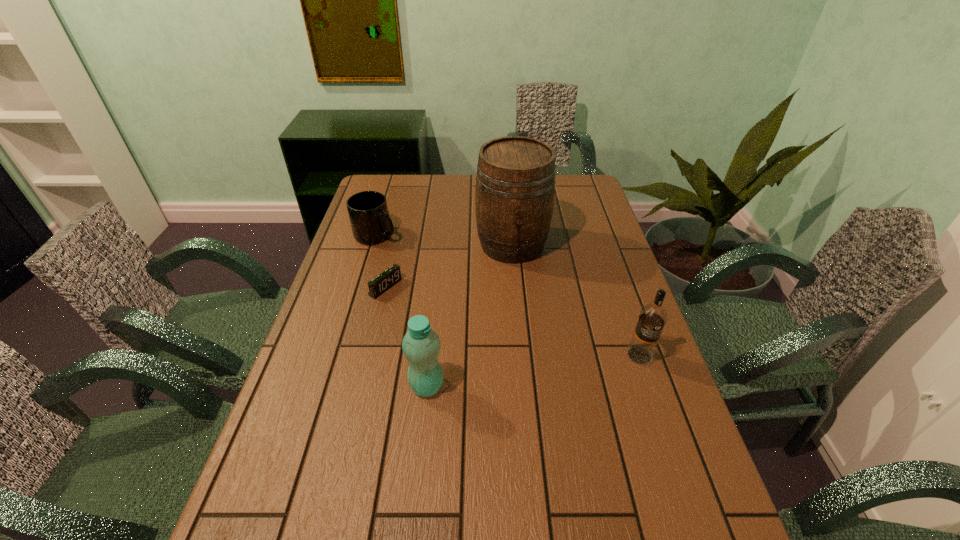
In order to click on vacant region located 0.150m on the label of the vodka in this screenshot , I will do `click(661, 419)`.

You are a GUI agent. You are given a task and a screenshot of the screen. Output one action in this format:
    pyautogui.click(x=<x>, y=<y>)
    Task: Click on the free space located on the side of the second object from right to left near the bung hole
    The image size is (960, 540).
    Given the screenshot: What is the action you would take?
    pyautogui.click(x=526, y=318)

This screenshot has width=960, height=540. I want to click on vacant region located 0.370m on the side of the second object from right to left near the bung hole, so click(x=534, y=361).

Identify the location of free space located 0.320m on the side of the second object from right to left near the bung hole. This screenshot has width=960, height=540. (531, 346).

The image size is (960, 540). Identify the location of vacant space situated with the handle on the side of the fourth tallest object. (422, 272).

You are a GUI agent. You are given a task and a screenshot of the screen. Output one action in this format:
    pyautogui.click(x=<x>, y=<y>)
    Task: Click on the vacant space located 0.180m with the handle on the side of the fourth tallest object
    The image size is (960, 540).
    Given the screenshot: What is the action you would take?
    pyautogui.click(x=419, y=269)

Identify the location of blank space located with the handle on the side of the fourth tallest object. (414, 265).

Where is `vacant region located on the front-facing side of the alarm clock`? vacant region located on the front-facing side of the alarm clock is located at coordinates (425, 312).

Identify the location of vacant point located on the front-facing side of the alarm clock. (410, 303).

Image resolution: width=960 pixels, height=540 pixels. What are the coordinates of `free location located 0.200m on the front-facing side of the alarm clock` in the screenshot? It's located at (446, 325).